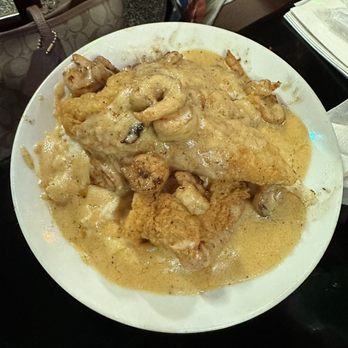
The width and height of the screenshot is (348, 348). Identify the location of black placemat. (294, 50).